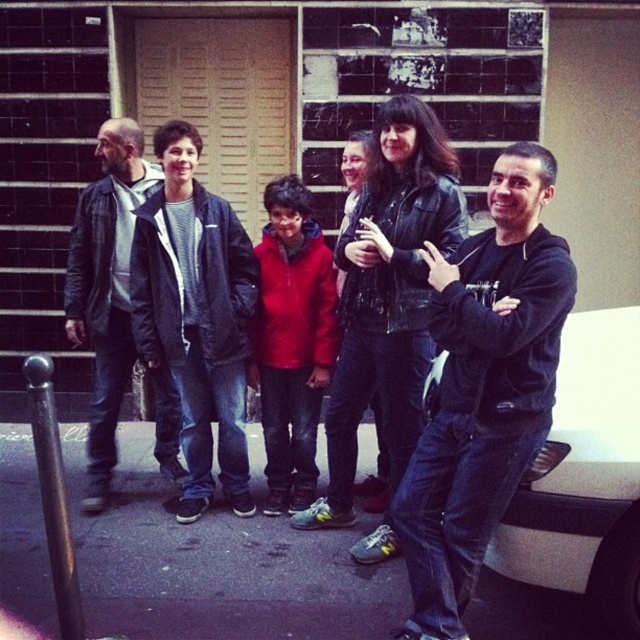
Question: Can you confirm if black matte car at right is positioned above leather jacket at left?

Choices:
 (A) yes
 (B) no

Answer: (B)

Question: Can you confirm if black matte car at right is bigger than leather jacket at left?

Choices:
 (A) yes
 (B) no

Answer: (A)

Question: Does black matte car at right appear on the left side of dark blue jacket at center?

Choices:
 (A) yes
 (B) no

Answer: (B)

Question: Which object is the farthest from the leather jacket at left?

Choices:
 (A) leather jacket at center
 (B) black matte car at right

Answer: (B)

Question: Which of the following is the farthest from the observer?

Choices:
 (A) (531, 168)
 (B) (179, 257)
 (C) (604, 500)

Answer: (B)

Question: Which object appears farthest from the camera in this image?

Choices:
 (A) black matte jacket at center
 (B) dark blue jacket at center

Answer: (B)